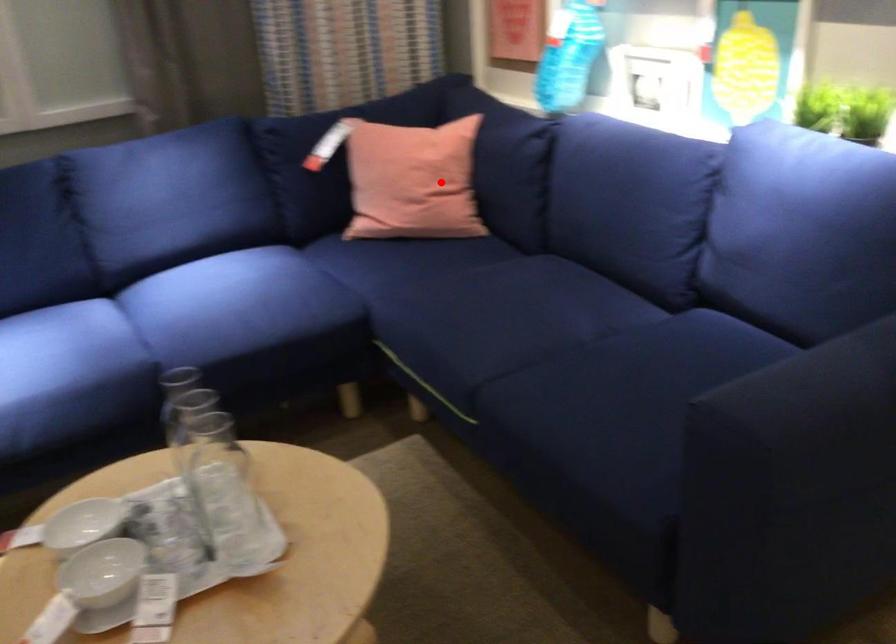
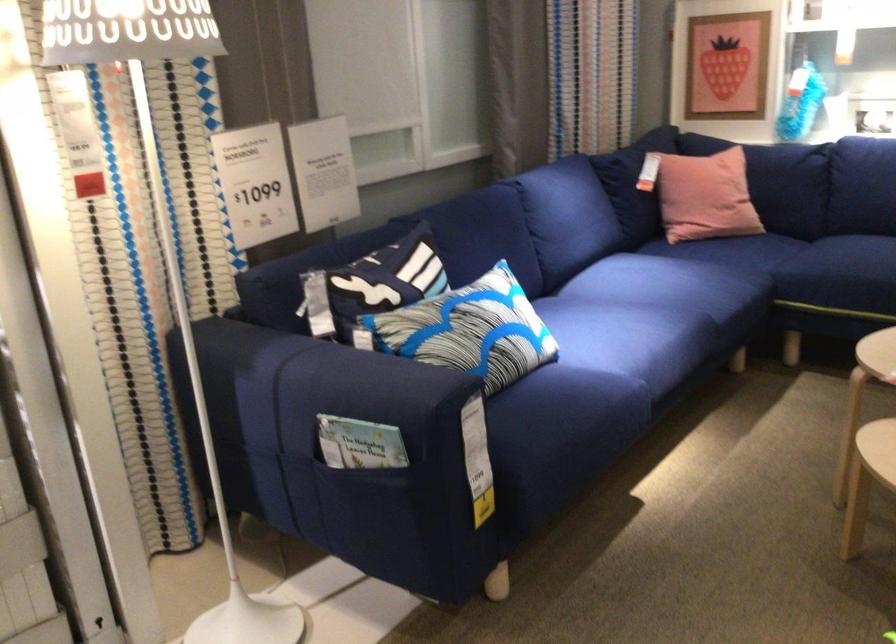
Question: I am providing you with two images of the same scene from different viewpoints. In image1, a red point is highlighted. Considering the same 3D point in image2, which of the following is correct?

Choices:
 (A) It is closer
 (B) It is farther

Answer: (B)